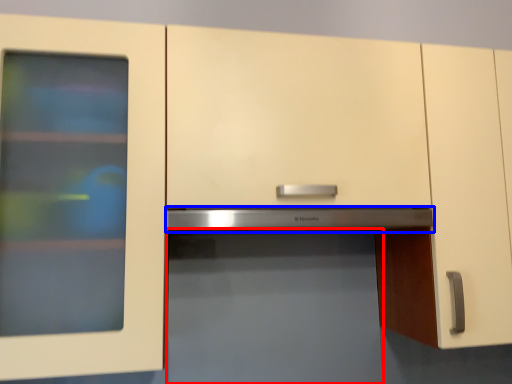
Question: Among these objects, which one is farthest to the camera, appliance (highlighted by a red box) or exhaust hood (highlighted by a blue box)?

Choices:
 (A) appliance
 (B) exhaust hood

Answer: (B)